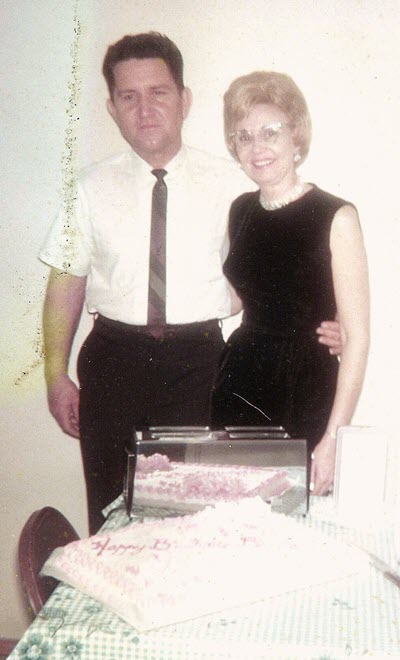
This screenshot has height=660, width=400. Identify the location of toaster. (238, 461).